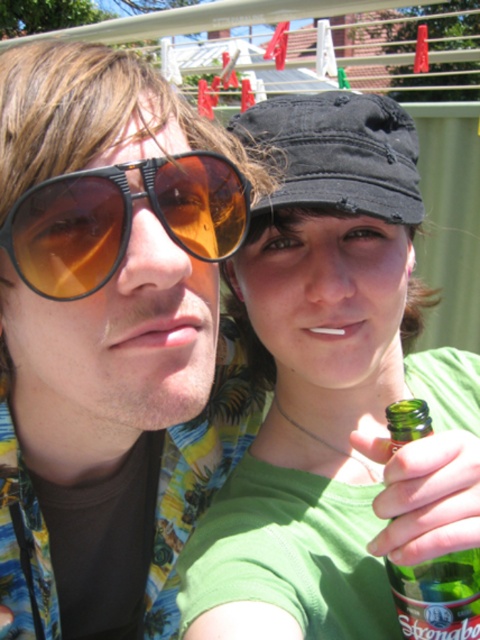
You are a delivery person who needs to place both the green matte bottle at center and the green glass bottle at lower right into a box that can only hold items up to the size of the larger bottle. Which bottle should you use as the reference for the box size?

The green matte bottle at center is larger in size than the green glass bottle at lower right, so you should use the green matte bottle at center as the reference for the box size.

You are a photographer trying to capture a closeup of the green glass bottle at lower right without the matte brown sunglasses at left blocking the view. Based on their positions, is this possible?

The matte brown sunglasses at left is above the green glass bottle at lower right, so moving the camera slightly downward might allow you to capture the green glass bottle at lower right without the sunglasses blocking the view.

You are a photographer trying to capture a closeup of the green matte bottle at center. The camera you are using has a focal length of 50mm. To ensure the bottle is in focus, you need to know its exact position. Based on the coordinates provided, can you determine if the bottle is positioned within the central 30x30 cm area of the frame?

The green matte bottle at center is located at point (333,388), which falls outside the central 30x30 cm area of the frame. Therefore, it may not be centered enough for the closeup.